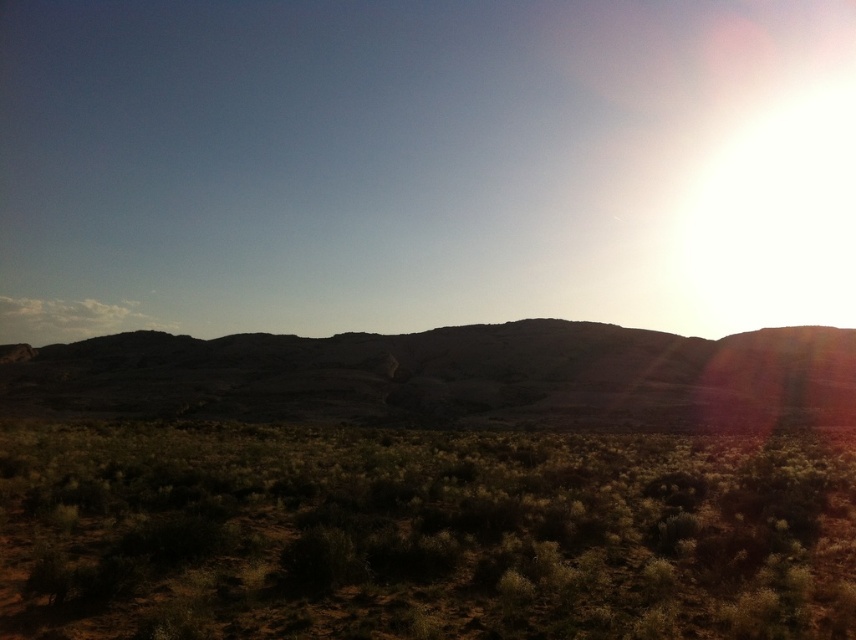
Is green shrubbery at lower center taller than dull brown rock at center?

No.

Which is behind, point (530, 566) or point (207, 348)?

The point (207, 348) is more distant.

This screenshot has width=856, height=640. In order to click on green shrubbery at lower center in this screenshot , I will do `click(420, 534)`.